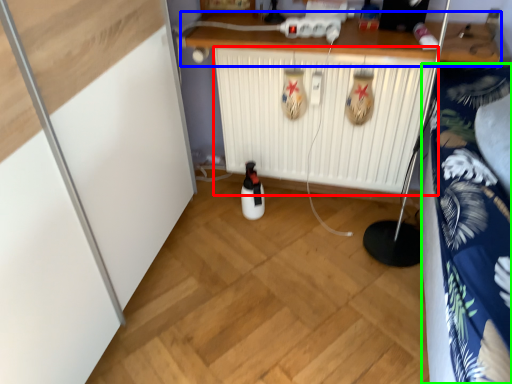
Question: Which object is the closest to the radiator (highlighted by a red box)? Choose among these: counter (highlighted by a blue box) or bedding (highlighted by a green box).

Choices:
 (A) counter
 (B) bedding

Answer: (A)